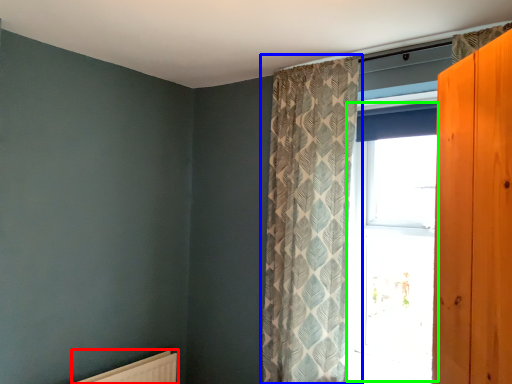
Question: Based on their relative distances, which object is nearer to radiator (highlighted by a red box)? Choose from curtain (highlighted by a blue box) and window (highlighted by a green box).

Choices:
 (A) curtain
 (B) window

Answer: (A)